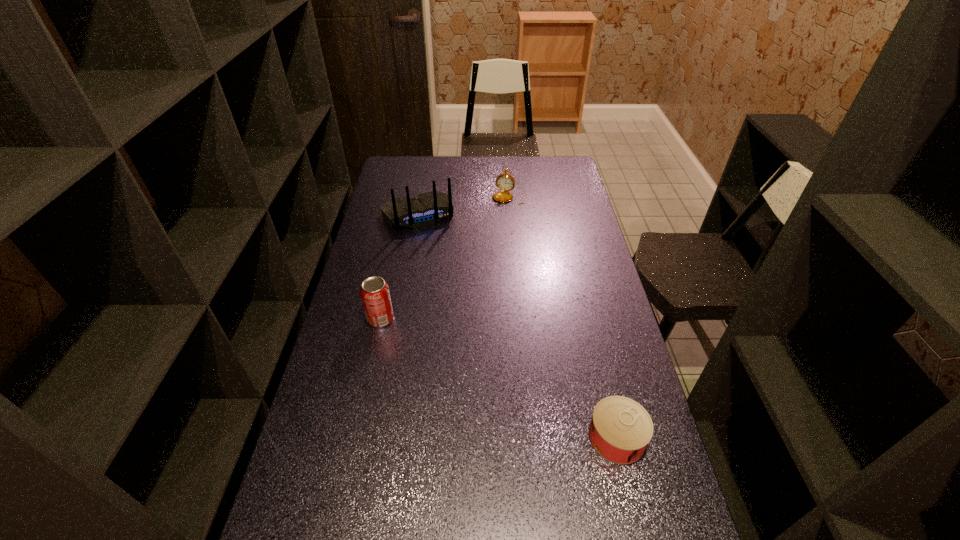
The width and height of the screenshot is (960, 540). I want to click on vacant region at the right edge, so (x=616, y=305).

Image resolution: width=960 pixels, height=540 pixels. What are the coordinates of `free spot at the far left corner of the desktop` in the screenshot? It's located at (391, 164).

I want to click on empty space between the router and the second nearest object, so click(x=399, y=267).

The width and height of the screenshot is (960, 540). I want to click on empty space that is in between the nearest object and the tallest object, so click(516, 326).

Where is `blank region between the router and the nearest object`? The height and width of the screenshot is (540, 960). blank region between the router and the nearest object is located at coordinates (516, 326).

You are a GUI agent. You are given a task and a screenshot of the screen. Output one action in this format:
    pyautogui.click(x=<x>, y=<y>)
    Task: Click on the free space between the nearest object and the router
    This screenshot has width=960, height=540.
    Given the screenshot: What is the action you would take?
    pyautogui.click(x=516, y=326)

Where is `free space between the third tallest object and the third shortest object`? The image size is (960, 540). free space between the third tallest object and the third shortest object is located at coordinates (445, 258).

Find the location of `vacant area between the router and the nearest object`. vacant area between the router and the nearest object is located at coordinates (516, 326).

The image size is (960, 540). Find the location of `vacant space in between the shortest object and the tallest object`. vacant space in between the shortest object and the tallest object is located at coordinates (516, 326).

At what (x,y) coordinates should I click in order to perform the action: click on vacant area that lies between the tallest object and the second tallest object. Please return your answer as a coordinate pair (x, y). Image resolution: width=960 pixels, height=540 pixels. Looking at the image, I should click on (399, 267).